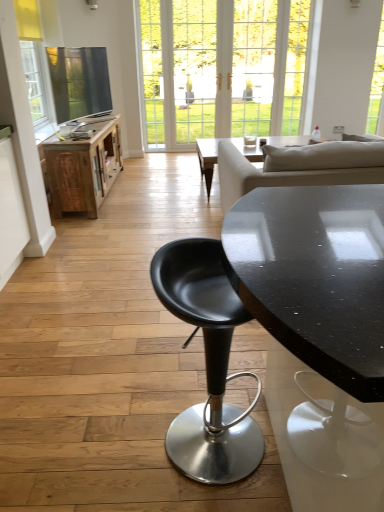
Question: Considering the relative sizes of wooden cabinet at left and black matte stool at center in the image provided, is wooden cabinet at left shorter than black matte stool at center?

Choices:
 (A) no
 (B) yes

Answer: (B)

Question: Is black matte stool at center at the back of wooden cabinet at left?

Choices:
 (A) no
 (B) yes

Answer: (A)

Question: Can you confirm if wooden cabinet at left is taller than black matte stool at center?

Choices:
 (A) no
 (B) yes

Answer: (A)

Question: Are wooden cabinet at left and black matte stool at center located far from each other?

Choices:
 (A) yes
 (B) no

Answer: (A)

Question: From a real-world perspective, is wooden cabinet at left positioned over black matte stool at center based on gravity?

Choices:
 (A) yes
 (B) no

Answer: (B)

Question: Is wooden cabinet at left completely or partially outside of black matte stool at center?

Choices:
 (A) yes
 (B) no

Answer: (A)

Question: Can you confirm if black matte stool at center is positioned to the right of wooden cabinet at left?

Choices:
 (A) no
 (B) yes

Answer: (B)

Question: From the image's perspective, does black matte stool at center appear lower than wooden cabinet at left?

Choices:
 (A) no
 (B) yes

Answer: (B)

Question: Is black matte stool at center looking in the opposite direction of wooden cabinet at left?

Choices:
 (A) yes
 (B) no

Answer: (B)

Question: Does black matte stool at center lie behind wooden cabinet at left?

Choices:
 (A) no
 (B) yes

Answer: (A)

Question: Can you confirm if black matte stool at center is thinner than wooden cabinet at left?

Choices:
 (A) no
 (B) yes

Answer: (B)

Question: Can you confirm if black matte stool at center is shorter than wooden cabinet at left?

Choices:
 (A) no
 (B) yes

Answer: (A)

Question: Considering the positions of point (215, 418) and point (115, 133), is point (215, 418) closer or farther from the camera than point (115, 133)?

Choices:
 (A) farther
 (B) closer

Answer: (B)